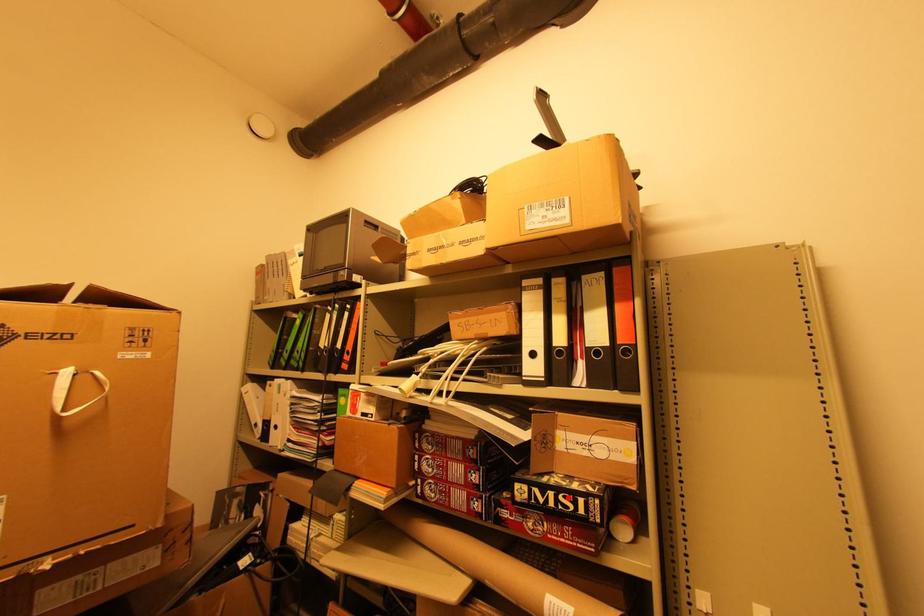
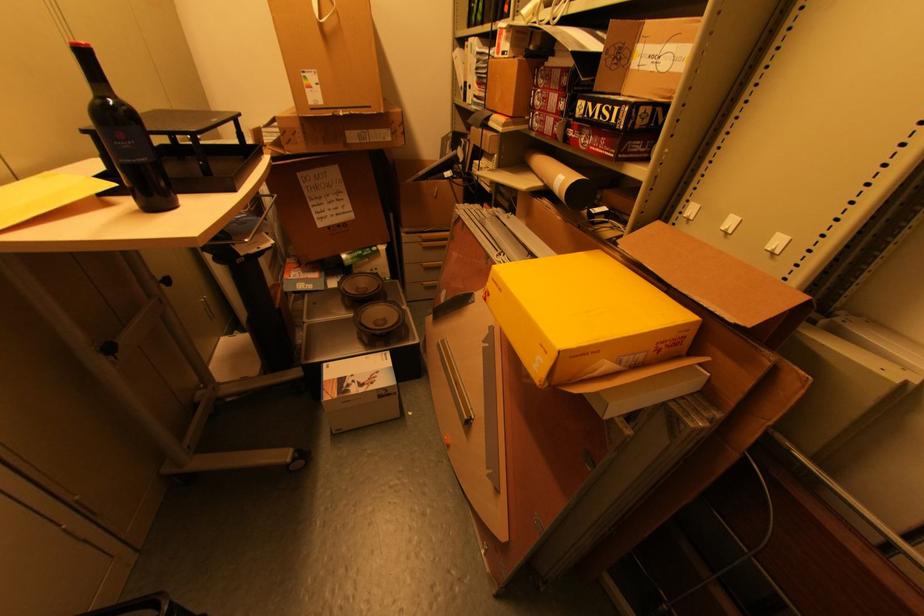
Find the pixel in the second image that matches the highlighted location in the first image.

(610, 108)